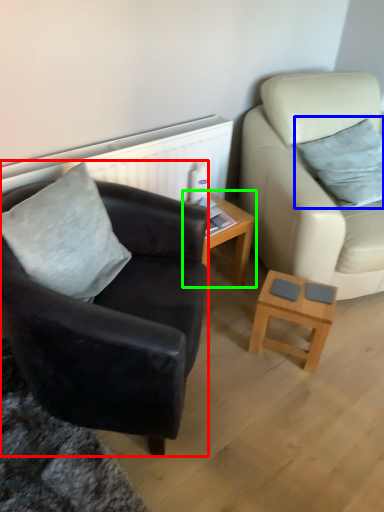
Question: Estimate the real-world distances between objects in this image. Which object is closer to chair (highlighted by a red box), pillow (highlighted by a blue box) or table (highlighted by a green box)?

Choices:
 (A) pillow
 (B) table

Answer: (B)